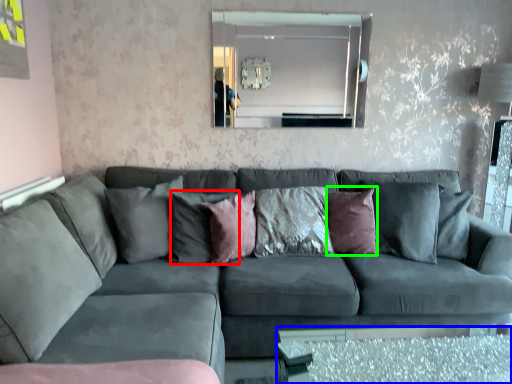
Question: Which object is positioned closest to pillow (highlighted by a red box)? Select from glass table (highlighted by a blue box) and pillow (highlighted by a green box).

Choices:
 (A) glass table
 (B) pillow

Answer: (B)